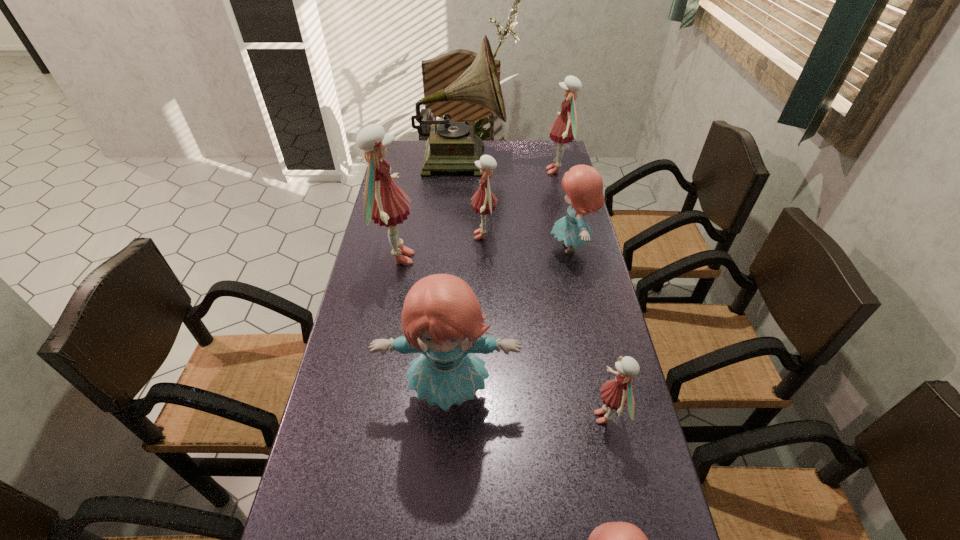
Where is `vacant space positioned 0.240m from the horn of the record player`? The width and height of the screenshot is (960, 540). vacant space positioned 0.240m from the horn of the record player is located at coordinates (563, 159).

Where is `vacant point located 0.330m on the front-facing side of the biggest pink doll`? vacant point located 0.330m on the front-facing side of the biggest pink doll is located at coordinates (521, 259).

Where is `blank space located on the front-facing side of the third smallest pink doll`? blank space located on the front-facing side of the third smallest pink doll is located at coordinates coord(501,171).

At what (x,y) coordinates should I click in order to perform the action: click on free location located 0.050m on the front-facing side of the third smallest pink doll. Please return your answer as a coordinate pair (x, y). This screenshot has height=540, width=960. Looking at the image, I should click on (531, 171).

Locate an element on the screen. The height and width of the screenshot is (540, 960). free space located on the front-facing side of the third smallest pink doll is located at coordinates (499, 171).

This screenshot has height=540, width=960. I want to click on vacant space located on the front-facing side of the leftmost blue doll, so click(x=443, y=509).

Where is `vacant point located on the front-facing side of the second smallest pink doll`? vacant point located on the front-facing side of the second smallest pink doll is located at coordinates (376, 236).

At what (x,y) coordinates should I click in order to perform the action: click on free space located 0.230m on the front-facing side of the second smallest pink doll. Please return your answer as a coordinate pair (x, y). Looking at the image, I should click on (x=403, y=236).

Where is `vacant space situated 0.170m on the front-facing side of the second smallest pink doll`? vacant space situated 0.170m on the front-facing side of the second smallest pink doll is located at coordinates (420, 236).

Locate an element on the screen. blank area located 0.140m on the front-facing side of the farthest blue doll is located at coordinates (505, 248).